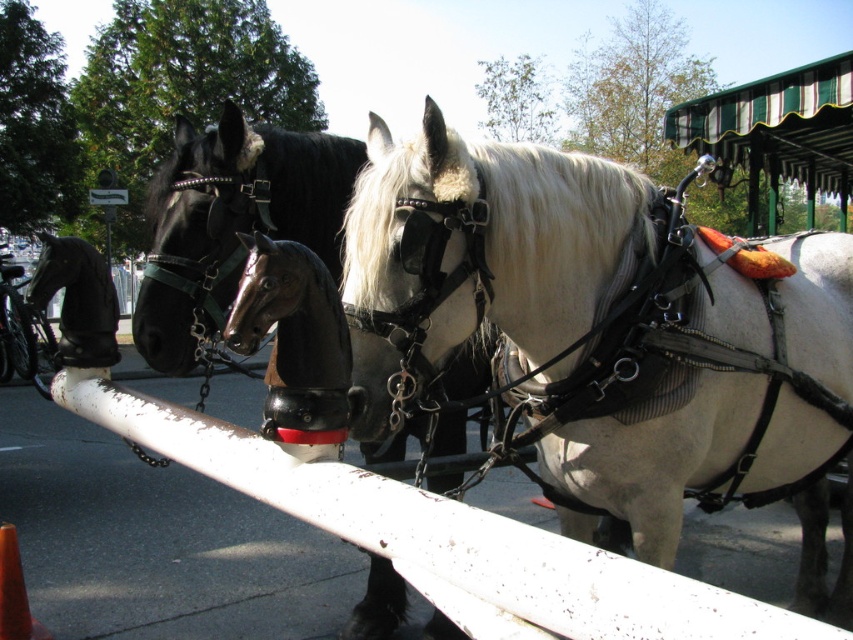
Can you confirm if white glossy horse at center is positioned to the left of shiny black horse at center?

Incorrect, white glossy horse at center is not on the left side of shiny black horse at center.

Is point (498, 262) farther from viewer compared to point (236, 145)?

No, (498, 262) is closer to viewer.

Is point (772, 243) farther from viewer compared to point (164, 188)?

Yes, point (772, 243) is behind point (164, 188).

This screenshot has width=853, height=640. In order to click on white glossy horse at center in this screenshot , I will do `click(607, 336)`.

Which is in front, point (825, 609) or point (71, 304)?

Point (71, 304)

Which is behind, point (421, 241) or point (41, 300)?

The point (41, 300) is behind.

Does point (393, 307) lie behind point (93, 253)?

No, it is in front of (93, 253).

This screenshot has height=640, width=853. Identify the location of white glossy horse at center. pos(607,336).

Which is behind, point (480, 355) or point (94, 365)?

Positioned behind is point (480, 355).

This screenshot has width=853, height=640. Identify the location of shiny black horse at center. (231, 220).